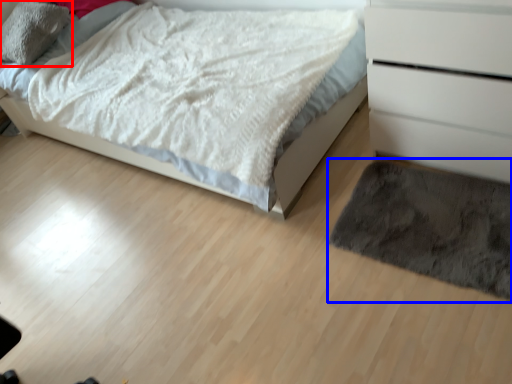
Question: Which object is further to the camera taking this photo, pillow (highlighted by a red box) or mat (highlighted by a blue box)?

Choices:
 (A) pillow
 (B) mat

Answer: (A)